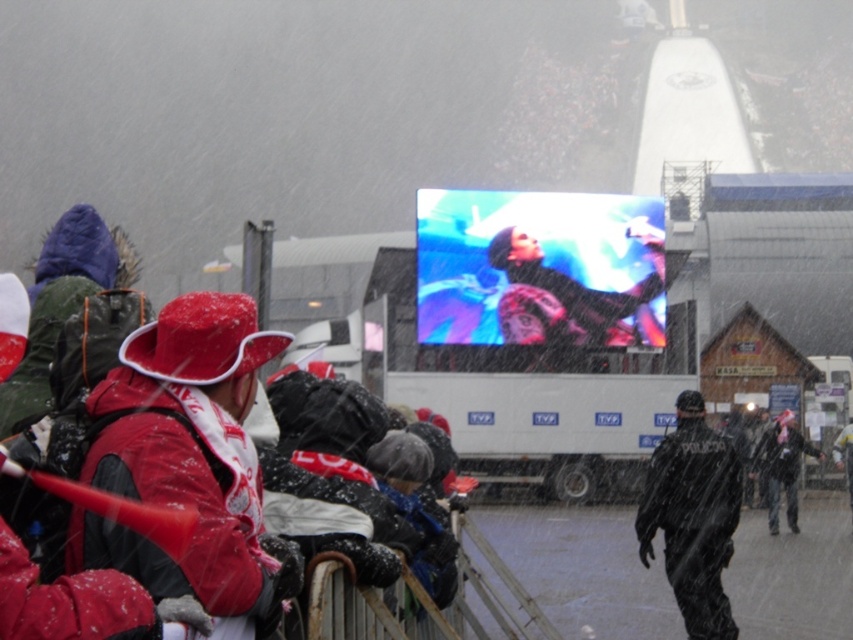
You are a photographer trying to capture the red matte hat at left and the black uniformed officer at center in the same frame. Which object should you focus on first to ensure both are in the frame without moving the camera?

The red matte hat at left should be focused on first because it is smaller in size compared to the black uniformed officer at center, ensuring both fit within the frame.

You are a photographer trying to capture a clear shot of the black uniformed officer at center and the dark gray fabric jacket at center. The camera lens can only focus on objects wider than 1.2 meters. Can both subjects be captured clearly?

The black uniformed officer at center is wider than the dark gray fabric jacket at center. Since the officer is wider, and assuming the jacket is narrower than 1.2 meters, the officer might be in focus but the jacket might not. However, without knowing the exact width of the officer, we cannot confirm if both meet the 1.2 meter requirement.

Consider the image. You are a photographer trying to capture a photo of the dark gray fabric jacket at center without including the red matte hat at left in the frame. Based on their positions, is this possible?

The red matte hat at left is to the left of the dark gray fabric jacket at center, so if you position yourself to the right side of the jacket, you can exclude the hat from the frame.